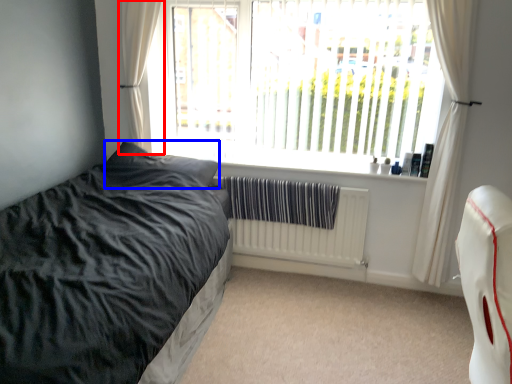
Question: Which object appears farthest to the camera in this image, curtain (highlighted by a red box) or pillow (highlighted by a blue box)?

Choices:
 (A) curtain
 (B) pillow

Answer: (A)